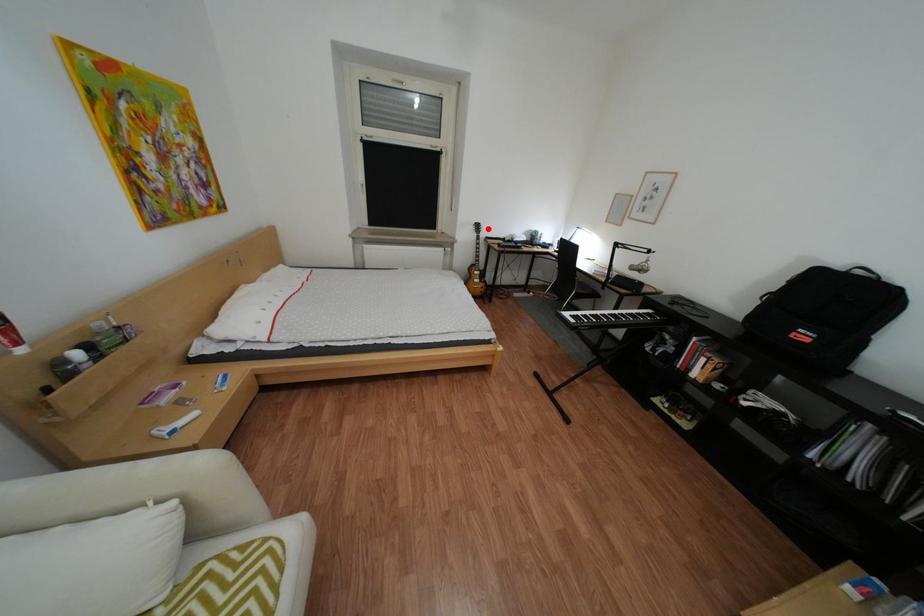
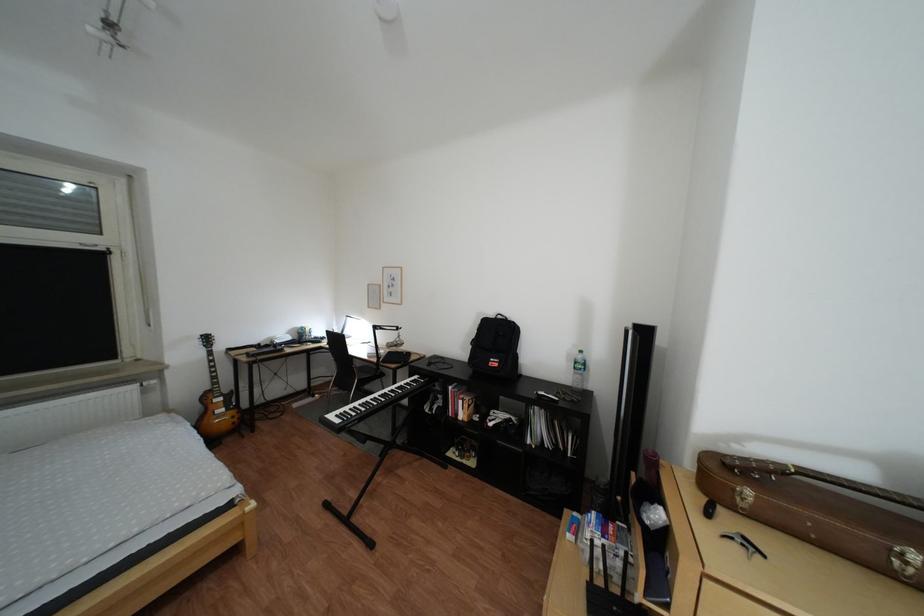
Question: I am providing you with two images of the same scene from different viewpoints. A red point is shown in image1. For the corresponding object point in image2, is it positioned nearer or farther from the camera?

Choices:
 (A) Nearer
 (B) Farther

Answer: (B)